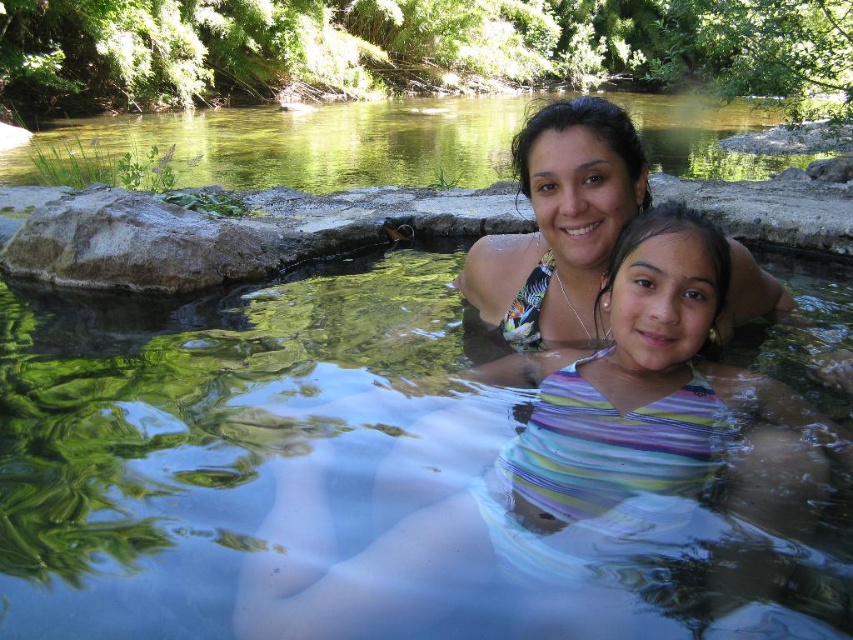
Consider the image. You are standing at the edge of the hot spring and want to walk to the point marked by point (685, 369). However, there is an obstacle at point (759, 156). Will you encounter the obstacle on your way?

Point (685, 369) is in front of point (759, 156), so you will not encounter the obstacle at point (759, 156) on your way to point (685, 369).

Based on the coordinates provided, can you identify which object in the scene corresponds to the point labeled as point (569, 460)?

The point (569, 460) corresponds to the striped fabric swimsuit at center.

From the picture: You are a photographer trying to capture a shot of the clear water at upper center and the multicolored bikini top at center. Which object is located above the other?

The clear water at upper center is positioned over the multicolored bikini top at center.